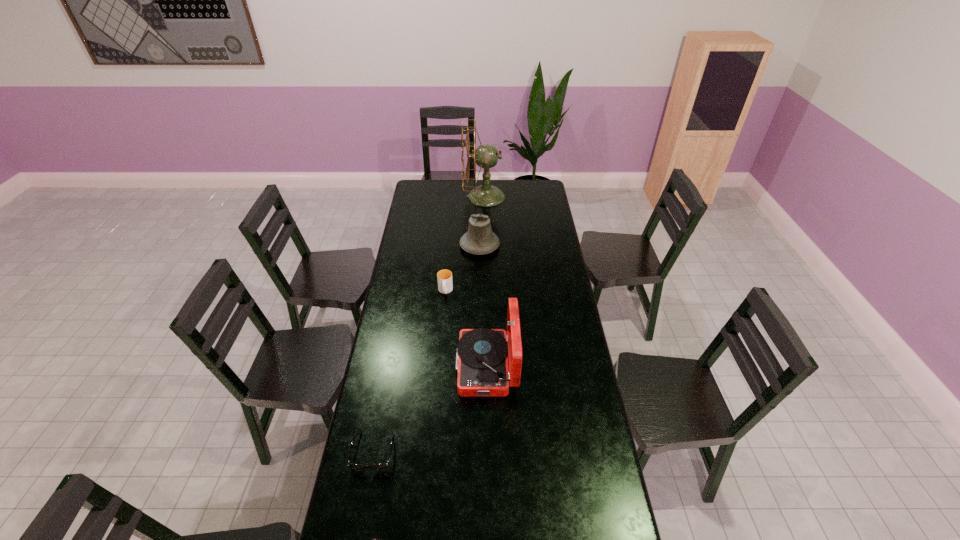
At what (x,y) coordinates should I click in order to perform the action: click on vacant space located 0.260m in front of the tallest object, directing air flow. Please return your answer as a coordinate pair (x, y). The height and width of the screenshot is (540, 960). Looking at the image, I should click on (421, 197).

I want to click on vacant point located 0.230m in front of the tallest object, directing air flow, so click(x=426, y=197).

This screenshot has height=540, width=960. What are the coordinates of `free space located in front of the tallest object, directing air flow` in the screenshot? It's located at (416, 197).

Find the location of a particular element. The image size is (960, 540). free space located 0.320m on the front-facing side of the third nearest object is located at coordinates (376, 367).

Identify the location of vacant space located 0.160m on the front-facing side of the third nearest object. This screenshot has width=960, height=540. tap(416, 367).

In order to click on vacant space located 0.260m on the front-facing side of the third nearest object in this screenshot , I will do `click(391, 367)`.

Locate an element on the screen. This screenshot has height=540, width=960. vacant space positioned 0.100m on the right of the fifth nearest object is located at coordinates (518, 246).

Where is `vacant area situated 0.250m with the handle on the side of the cup`? The width and height of the screenshot is (960, 540). vacant area situated 0.250m with the handle on the side of the cup is located at coordinates (441, 341).

Identify the location of vacant area situated on the lenses of the fifth tallest object. The image size is (960, 540). (361, 519).

The width and height of the screenshot is (960, 540). What are the coordinates of `object present at the far edge` in the screenshot? It's located at (487, 156).